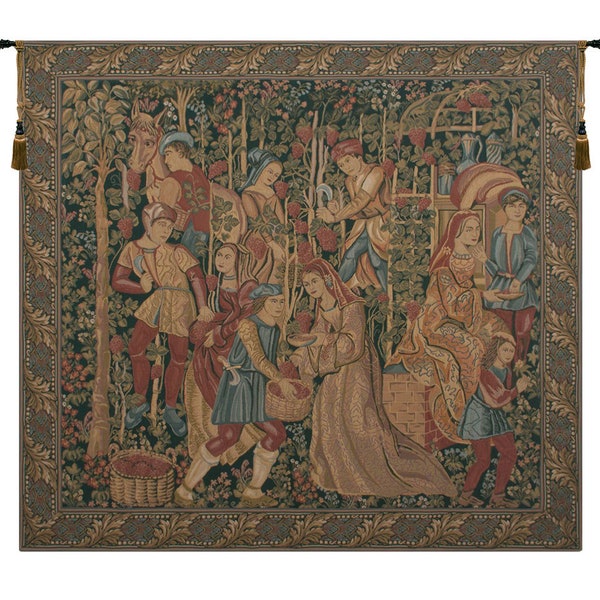
Image resolution: width=600 pixels, height=600 pixels. What are the coordinates of `basket` in the screenshot? It's located at (136, 492), (283, 409).